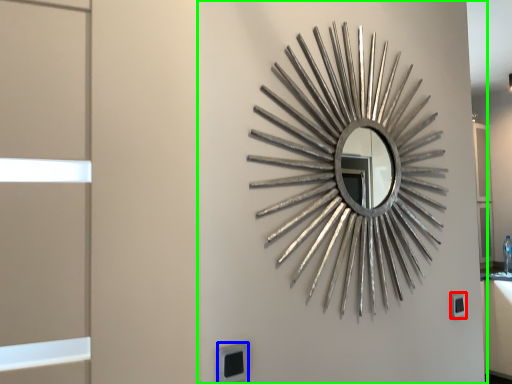
Question: Which is farther away from electric outlet (highlighted by a red box)? electric outlet (highlighted by a blue box) or backdrop (highlighted by a green box)?

Choices:
 (A) electric outlet
 (B) backdrop

Answer: (A)